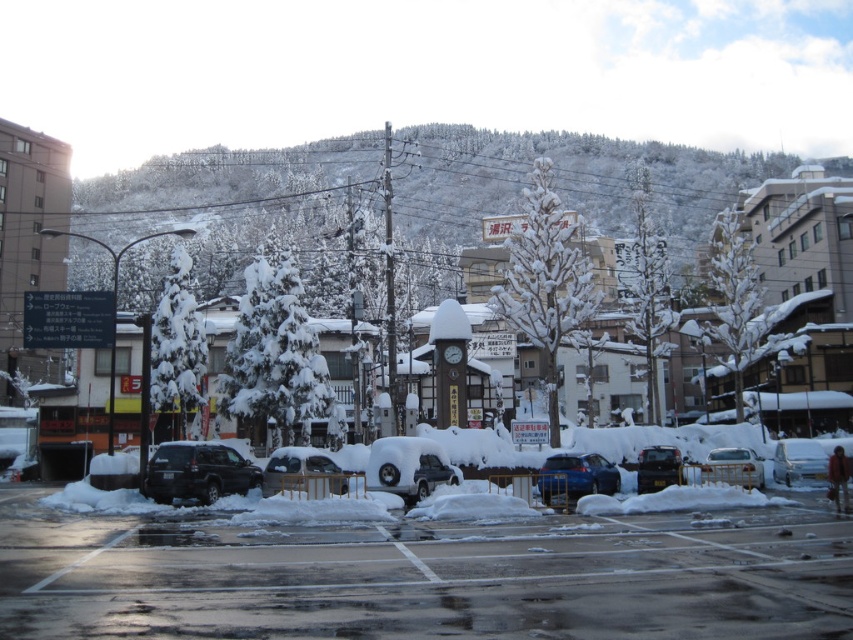
Is snow-covered suv at center thinner than white matte car at center?

Yes, snow-covered suv at center is thinner than white matte car at center.

Does snow-covered suv at center appear on the left side of white matte car at center?

Indeed, snow-covered suv at center is positioned on the left side of white matte car at center.

This screenshot has height=640, width=853. What do you see at coordinates (408, 467) in the screenshot?
I see `snow-covered suv at center` at bounding box center [408, 467].

Locate an element on the screen. The width and height of the screenshot is (853, 640). snow-covered suv at center is located at coordinates (408, 467).

Which is more to the left, white matte car at center or matte black car at center?

matte black car at center

Is the position of white matte car at center more distant than that of matte black car at center?

That is False.

Looking at this image, measure the distance between white matte car at center and camera.

25.62 meters

The height and width of the screenshot is (640, 853). Find the location of `white matte car at center`. white matte car at center is located at coordinates point(733,467).

The width and height of the screenshot is (853, 640). Identify the location of snow-covered suv at center. (408, 467).

Can you confirm if snow-covered suv at center is positioned below metallic blue sedan at center?

Actually, snow-covered suv at center is above metallic blue sedan at center.

The height and width of the screenshot is (640, 853). What are the coordinates of `snow-covered suv at center` in the screenshot? It's located at (408, 467).

This screenshot has height=640, width=853. Identify the location of snow-covered suv at center. (408, 467).